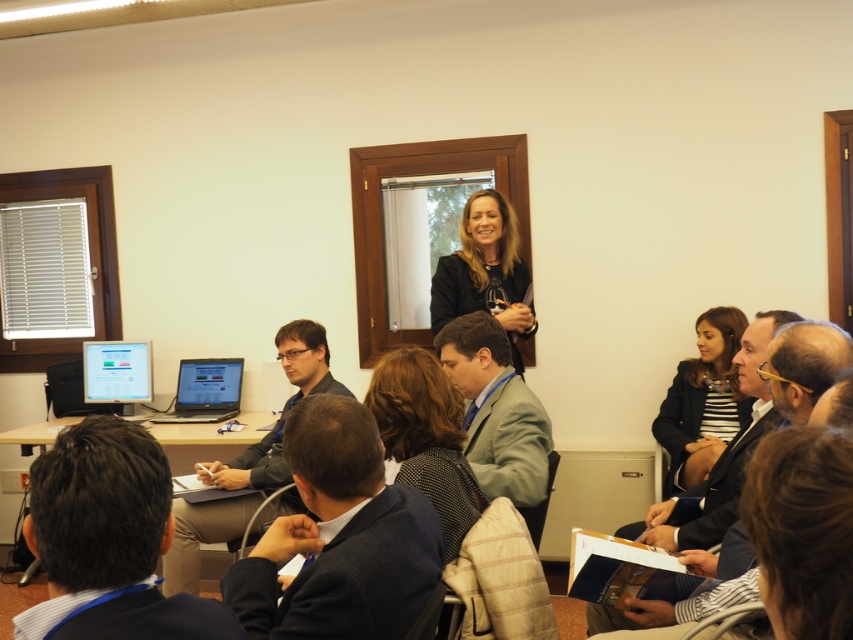
You are organizing a photo shoot in this conference room and need to ensure that the dark brown hair at center and the black leather jacket at upper center are both visible in the frame. Given their sizes, which object should you focus on to ensure both are captured adequately?

The dark brown hair at center is smaller than the black leather jacket at upper center, so you should focus on the black leather jacket at upper center to ensure both objects are visible in the frame.

You are standing at the entrance of the conference room and want to find the person with dark brown hair at center. According to the coordinate system where the bottom left corner is the origin, can you tell me the exact coordinates of where to look?

The dark brown hair at center is located at coordinates point (426, 436).